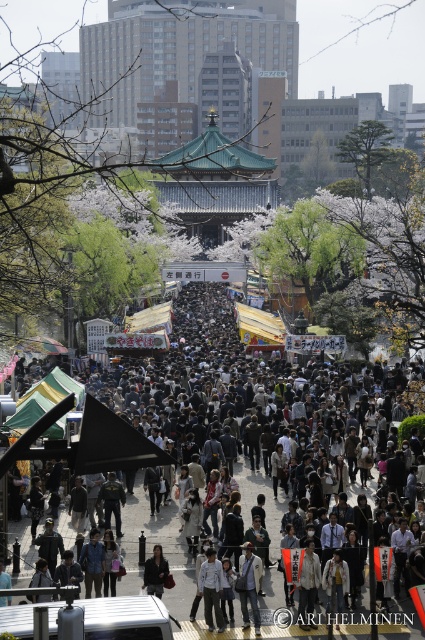
Question: Which of the following is the farthest from the observer?

Choices:
 (A) (217, 564)
 (B) (251, 568)

Answer: (B)

Question: Among these points, which one is farthest from the camera?

Choices:
 (A) (150, 588)
 (B) (139, 476)
 (C) (260, 566)
 (D) (214, 564)

Answer: (B)

Question: Is dark gray jacket at center bigger than light gray fabric jacket at center?

Choices:
 (A) no
 (B) yes

Answer: (B)

Question: Which of the following is the farthest from the observer?

Choices:
 (A) light brown leather jacket at center
 (B) light gray fabric jacket at center
 (C) dark gray jacket at center

Answer: (A)

Question: Can you confirm if dark gray jacket at center is thinner than light brown leather jacket at center?

Choices:
 (A) yes
 (B) no

Answer: (B)

Question: Where is dark gray jacket at center located in relation to light gray fabric jacket at center in the image?

Choices:
 (A) below
 (B) above

Answer: (B)